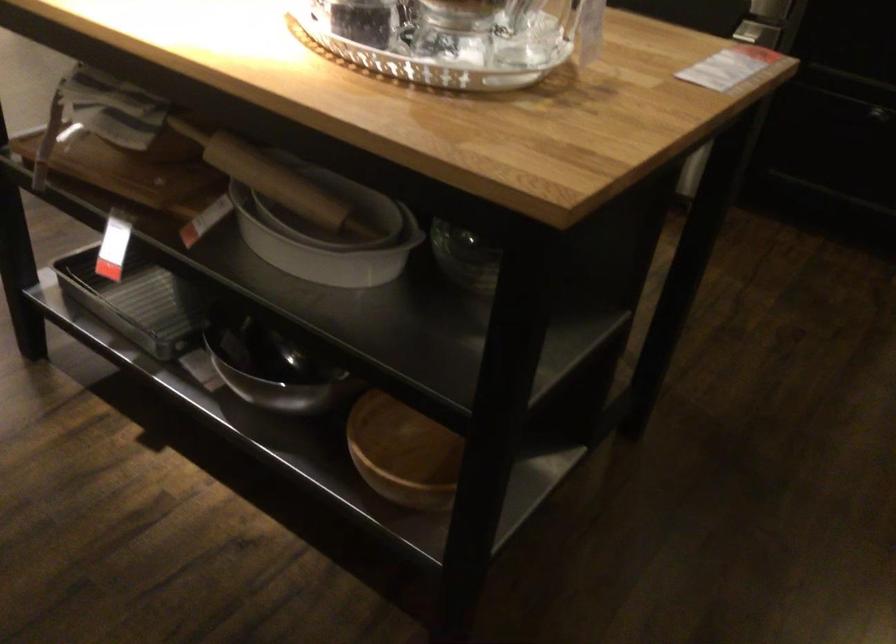
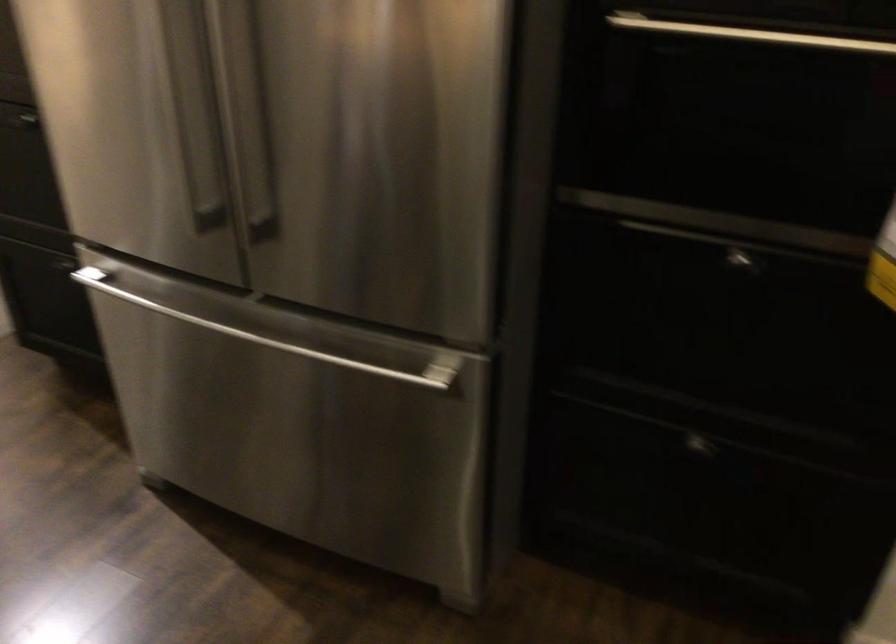
What movement of the cameraman would produce the second image?

The cameraman moved toward right, forward.